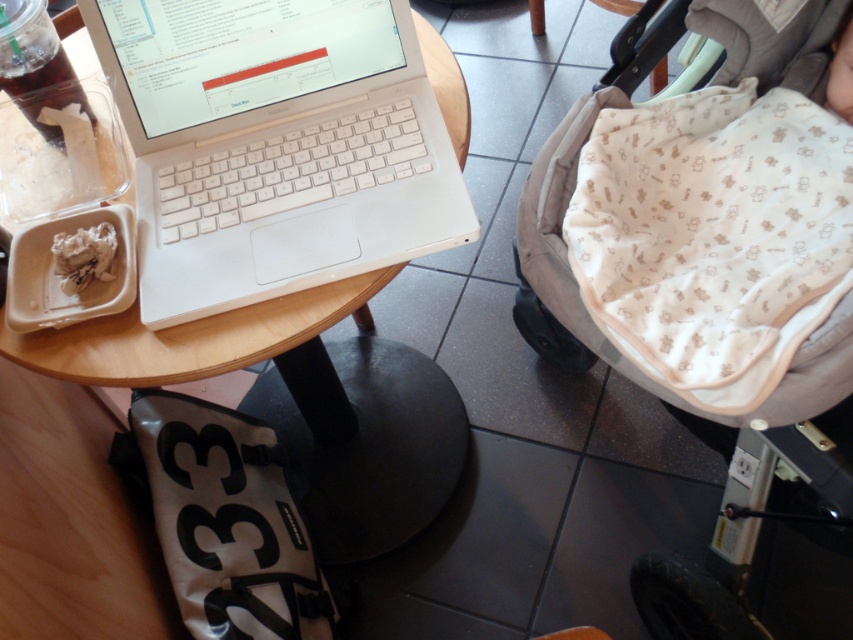
Question: Among these objects, which one is nearest to the camera?

Choices:
 (A) white plastic laptop at center
 (B) white crumpled paper at left

Answer: (A)

Question: Estimate the real-world distances between objects in this image. Which object is farther from the white crumpled paper at left?

Choices:
 (A) beige fabric baby carriage at center
 (B) white plastic laptop at center

Answer: (A)

Question: Is beige fabric baby carriage at center to the right of white crumpled paper at left from the viewer's perspective?

Choices:
 (A) no
 (B) yes

Answer: (B)

Question: Does beige fabric baby carriage at center appear over white crumpled paper at left?

Choices:
 (A) no
 (B) yes

Answer: (B)

Question: Does white plastic laptop at center lie behind beige fabric baby carriage at center?

Choices:
 (A) yes
 (B) no

Answer: (A)

Question: Which object appears closest to the camera in this image?

Choices:
 (A) white plastic laptop at center
 (B) white crumpled paper at left
 (C) beige fabric baby carriage at center

Answer: (C)